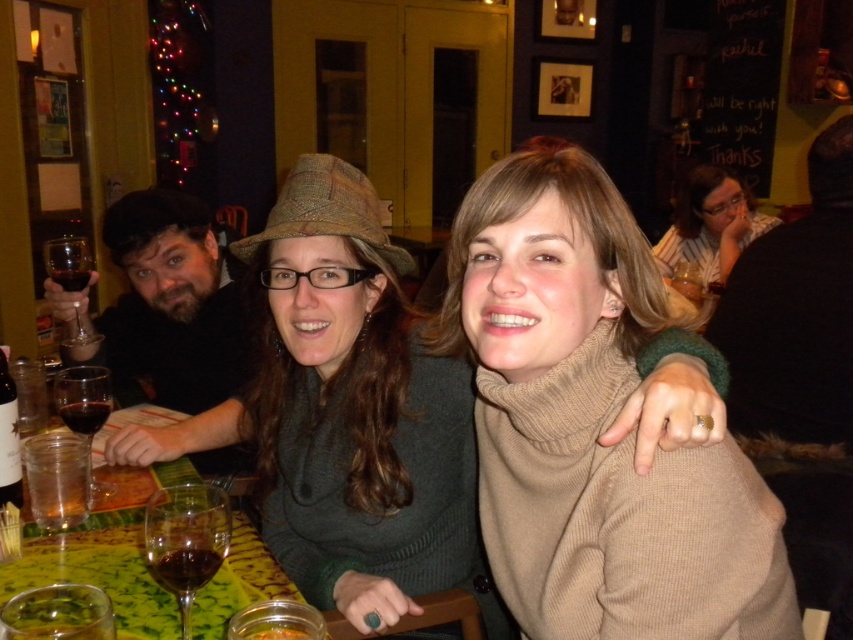
Does knitted green sweater at center have a lesser height compared to translucent glass wine glass at lower left?

In fact, knitted green sweater at center may be taller than translucent glass wine glass at lower left.

Can you confirm if knitted green sweater at center is positioned to the right of translucent glass wine glass at lower left?

Indeed, knitted green sweater at center is positioned on the right side of translucent glass wine glass at lower left.

Does point (463, 378) come closer to viewer compared to point (190, 570)?

No, (463, 378) is behind (190, 570).

Where is `knitted green sweater at center`? The height and width of the screenshot is (640, 853). knitted green sweater at center is located at coordinates (341, 403).

Can you confirm if transparent glass at lower left is thinner than translucent glass at table left?

No, transparent glass at lower left is not thinner than translucent glass at table left.

Is transparent glass at lower left positioned in front of translucent glass at table left?

That is True.

Who is more forward, (107, 371) or (83, 412)?

Point (83, 412) is more forward.

Identify the location of transparent glass at lower left. (83, 404).

Can you confirm if beige wool sweater at center is smaller than transparent glass at lower left?

No, beige wool sweater at center is not smaller than transparent glass at lower left.

Is beige wool sweater at center to the right of transparent glass at lower left from the viewer's perspective?

Correct, you'll find beige wool sweater at center to the right of transparent glass at lower left.

Between point (618, 458) and point (90, 435), which one is positioned in front?

Point (618, 458) is more forward.

At what (x,y) coordinates should I click in order to perform the action: click on beige wool sweater at center. Please return your answer as a coordinate pair (x, y). This screenshot has width=853, height=640. Looking at the image, I should click on (593, 424).